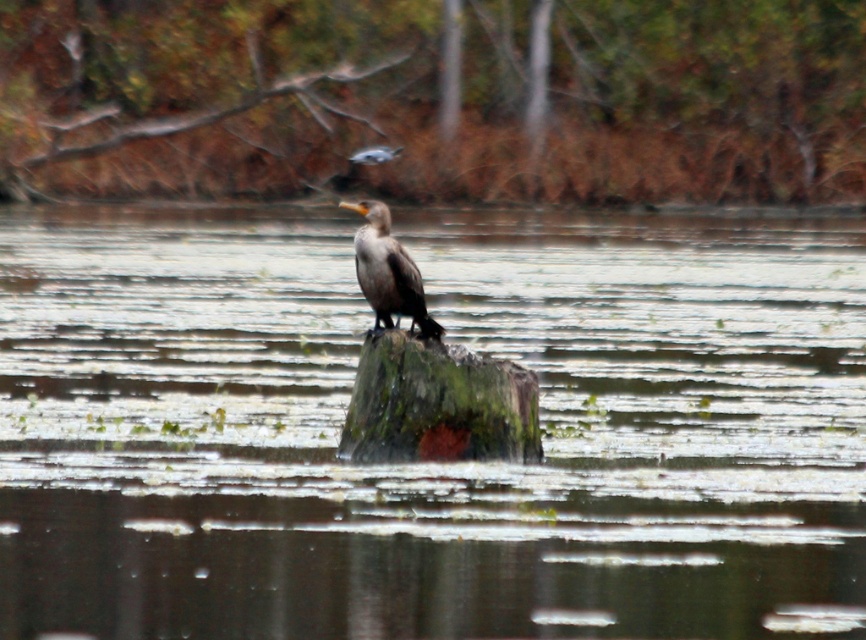
Which is above, brown wood at upper center or green mossy stump at center?

brown wood at upper center is higher up.

Identify the location of brown wood at upper center. (435, 99).

Locate an element on the screen. The image size is (866, 640). brown wood at upper center is located at coordinates (435, 99).

Can you confirm if brown wood at upper center is smaller than dark brown feathers at center?

No.

Is brown wood at upper center below dark brown feathers at center?

No.

Who is more forward, (181, 38) or (382, 220)?

Point (382, 220)

Locate an element on the screen. brown wood at upper center is located at coordinates (435, 99).

Does green mossy log at center have a smaller size compared to green mossy stump at center?

Incorrect, green mossy log at center is not smaller in size than green mossy stump at center.

Does point (486, 259) lie in front of point (506, 400)?

No, it is not.

Image resolution: width=866 pixels, height=640 pixels. What do you see at coordinates (431, 464) in the screenshot?
I see `green mossy log at center` at bounding box center [431, 464].

This screenshot has height=640, width=866. I want to click on green mossy log at center, so click(431, 464).